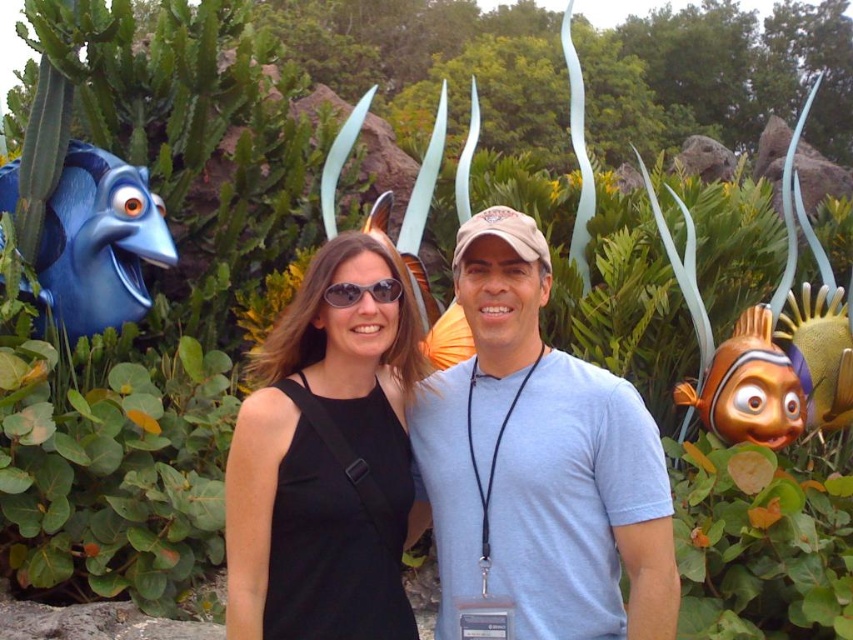
Question: Among these points, which one is farthest from the camera?

Choices:
 (A) (532, 496)
 (B) (64, 252)
 (C) (344, 353)

Answer: (B)

Question: Which point is farther to the camera?

Choices:
 (A) black matte dress at center
 (B) matte blue fish at left
 (C) light blue cotton t-shirt at center

Answer: (B)

Question: Based on their relative distances, which object is nearer to the light blue cotton t-shirt at center?

Choices:
 (A) black matte dress at center
 (B) matte blue fish at left

Answer: (A)

Question: Is black matte dress at center bigger than matte blue fish at left?

Choices:
 (A) yes
 (B) no

Answer: (B)

Question: Where is light blue cotton t-shirt at center located in relation to black matte dress at center in the image?

Choices:
 (A) below
 (B) above

Answer: (A)

Question: Does light blue cotton t-shirt at center have a lesser width compared to matte blue fish at left?

Choices:
 (A) yes
 (B) no

Answer: (B)